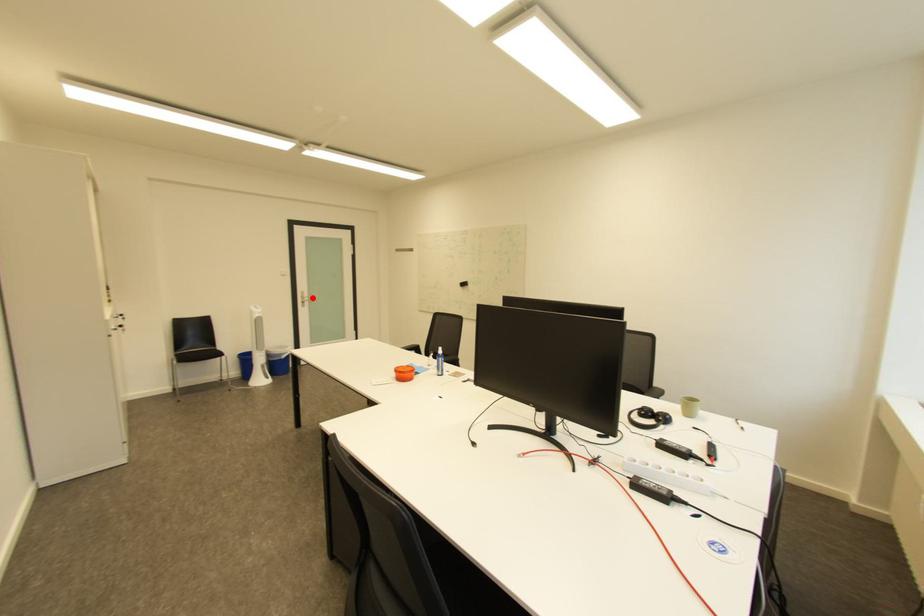
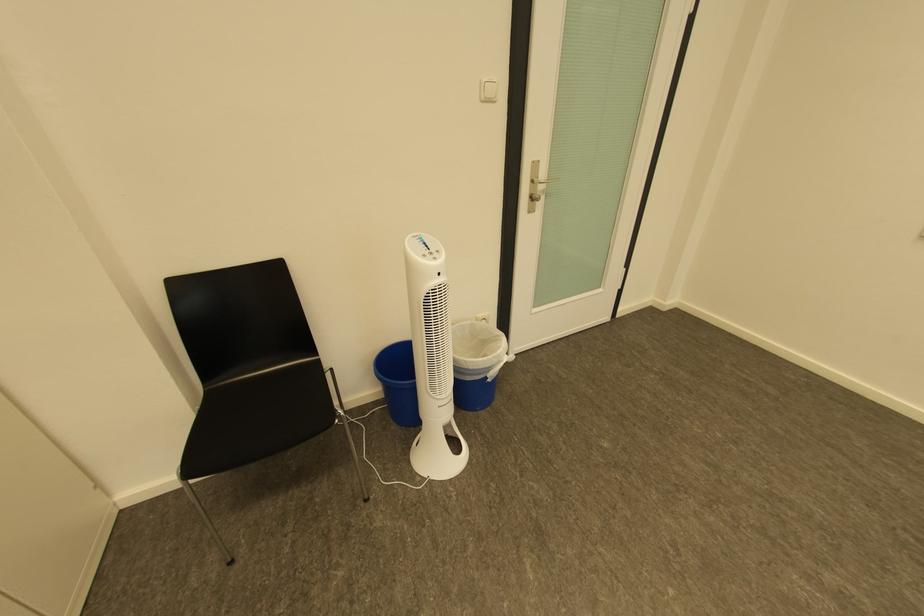
Locate, in the second image, the point that corresponds to the highlighted location in the first image.

(541, 182)